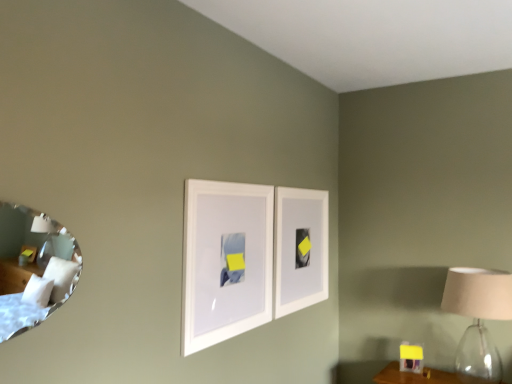
Question: Does point (231, 304) appear closer or farther from the camera than point (50, 269)?

Choices:
 (A) farther
 (B) closer

Answer: (A)

Question: From a real-world perspective, is white matte picture frame at center, which appears as the second picture frame when viewed from the back, physically located above or below silver reflective mirror at left?

Choices:
 (A) above
 (B) below

Answer: (B)

Question: Which is farther from the matte beige lampshade at right?

Choices:
 (A) white matte picture frame at center, acting as the first picture frame starting from the right
 (B) white matte picture frame at center, the first picture frame viewed from the front
 (C) silver reflective mirror at left

Answer: (C)

Question: Which is farther from the matte beige lampshade at right?

Choices:
 (A) white matte picture frame at center, which appears as the second picture frame when viewed from the back
 (B) white matte picture frame at center, the 2th picture frame in the left-to-right sequence
 (C) silver reflective mirror at left

Answer: (C)